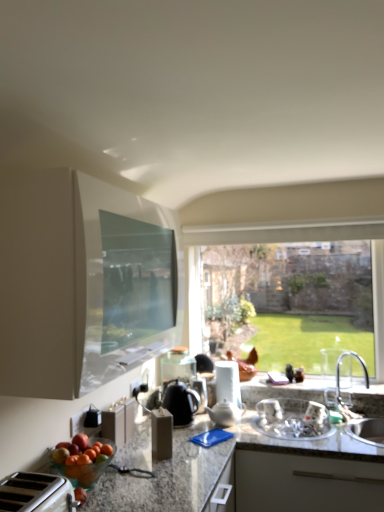
Question: Is white glossy sink at lower center, the 1th sink in the left-to-right sequence, with white glossy cabinet at upper left, the first cabinetry in the top-to-bottom sequence?

Choices:
 (A) no
 (B) yes

Answer: (A)

Question: Is white glossy sink at lower center, the second sink from the right, aimed at white glossy cabinet at upper left, the first cabinetry in the top-to-bottom sequence?

Choices:
 (A) yes
 (B) no

Answer: (B)

Question: Can you confirm if white glossy sink at lower center, the 1th sink in the left-to-right sequence, is smaller than white glossy cabinet at upper left, the first cabinetry in the top-to-bottom sequence?

Choices:
 (A) no
 (B) yes

Answer: (B)

Question: Does white glossy sink at lower center, the 1th sink in the left-to-right sequence, appear on the right side of white glossy cabinet at upper left, which is the second cabinetry from bottom to top?

Choices:
 (A) no
 (B) yes

Answer: (B)

Question: Is white glossy sink at lower center, the 1th sink in the left-to-right sequence, in front of white glossy cabinet at upper left, the first cabinetry in the top-to-bottom sequence?

Choices:
 (A) yes
 (B) no

Answer: (B)

Question: Is white ceramic teapot at center, which is the first tea pot from right to left, taller or shorter than black glossy tea pot at center, which ranks as the 2th tea pot in right-to-left order?

Choices:
 (A) tall
 (B) short

Answer: (B)

Question: Considering the positions of point (233, 422) and point (185, 407), is point (233, 422) closer or farther from the camera than point (185, 407)?

Choices:
 (A) closer
 (B) farther

Answer: (A)

Question: In terms of width, does white ceramic teapot at center, positioned as the second tea pot in left-to-right order, look wider or thinner when compared to black glossy tea pot at center, which ranks as the 2th tea pot in right-to-left order?

Choices:
 (A) wide
 (B) thin

Answer: (B)

Question: Is white ceramic teapot at center, positioned as the second tea pot in left-to-right order, bigger or smaller than black glossy tea pot at center, which ranks as the 2th tea pot in right-to-left order?

Choices:
 (A) big
 (B) small

Answer: (B)

Question: From a real-world perspective, is white plastic toaster at lower left, the first appliance when ordered from left to right, above or below white glossy paper towel dispenser at center, which ranks as the 3th appliance in left-to-right order?

Choices:
 (A) below
 (B) above

Answer: (A)

Question: Relative to white glossy paper towel dispenser at center, the 1th appliance in the back-to-front sequence, is white plastic toaster at lower left, placed as the third appliance when sorted from right to left, in front or behind?

Choices:
 (A) front
 (B) behind

Answer: (A)

Question: Looking at their shapes, would you say white plastic toaster at lower left, the 1th appliance from the front, is wider or thinner than white glossy paper towel dispenser at center, which is counted as the third appliance, starting from the front?

Choices:
 (A) thin
 (B) wide

Answer: (B)

Question: From the image's perspective, is white plastic toaster at lower left, which is the third appliance in back-to-front order, above or below white glossy paper towel dispenser at center, acting as the 1th appliance starting from the right?

Choices:
 (A) below
 (B) above

Answer: (A)

Question: In the image, is clear glass window at center on the left side or the right side of white ceramic sink at right, placed as the second sink when sorted from left to right?

Choices:
 (A) right
 (B) left

Answer: (B)

Question: Is point (187, 286) closer or farther from the camera than point (362, 431)?

Choices:
 (A) closer
 (B) farther

Answer: (B)